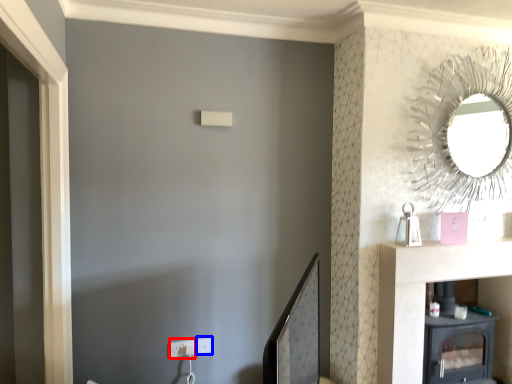
Question: Which object is closer to the camera taking this photo, electric outlet (highlighted by a red box) or electric outlet (highlighted by a blue box)?

Choices:
 (A) electric outlet
 (B) electric outlet

Answer: (A)